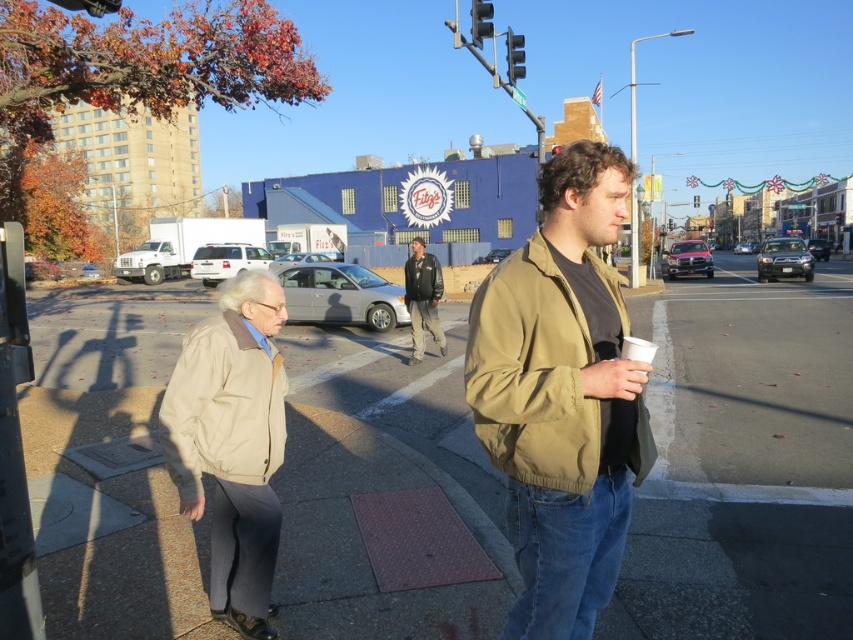
Question: Can you confirm if beige fabric jacket at lower left is positioned to the left of leather jacket at center?

Choices:
 (A) no
 (B) yes

Answer: (A)

Question: Which of the following is the farthest from the observer?

Choices:
 (A) (415, 275)
 (B) (489, 29)
 (C) (241, 467)
 (D) (432, 259)

Answer: (B)

Question: Does smooth concrete sidewalk at center appear on the left side of leather jacket at center?

Choices:
 (A) yes
 (B) no

Answer: (B)

Question: Which of these objects is positioned closest to the smooth concrete sidewalk at center?

Choices:
 (A) olive-green fabric jacket at center-right
 (B) metallic traffic light at upper center
 (C) dark blue leather jacket at center
 (D) leather jacket at center

Answer: (D)

Question: Is olive-green fabric jacket at center-right behind metallic traffic light at upper center?

Choices:
 (A) yes
 (B) no

Answer: (B)

Question: Which object appears closest to the camera in this image?

Choices:
 (A) metallic traffic light at upper center
 (B) olive-green fabric jacket at center-right

Answer: (B)